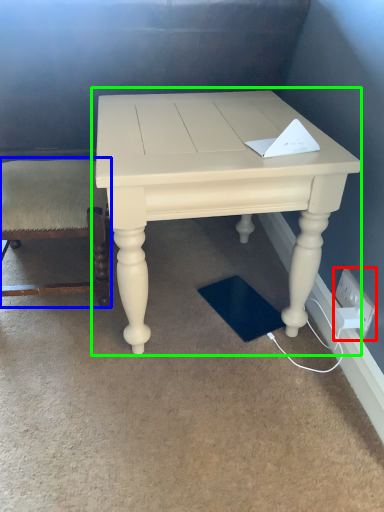
Question: Based on their relative distances, which object is nearer to electric outlet (highlighted by a red box)? Choose from chair (highlighted by a blue box) and table (highlighted by a green box).

Choices:
 (A) chair
 (B) table

Answer: (B)